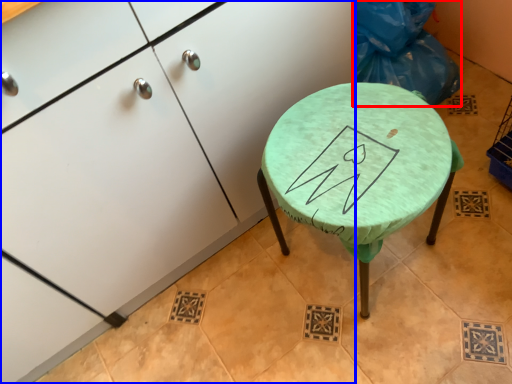
Question: Which object is closer to the camera taking this photo, garbage (highlighted by a red box) or cabinetry (highlighted by a blue box)?

Choices:
 (A) garbage
 (B) cabinetry

Answer: (B)